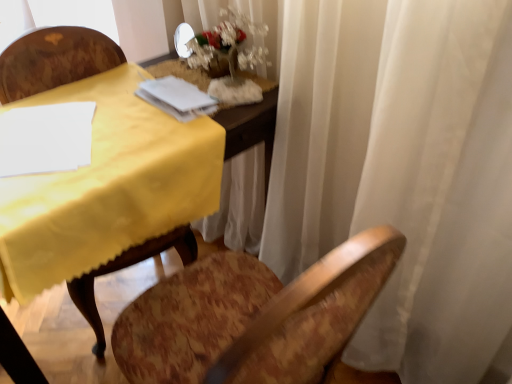
Question: From the image's perspective, would you say white frosted glass vase at upper center is shown under white paper at upper center?

Choices:
 (A) yes
 (B) no

Answer: (B)

Question: Is white frosted glass vase at upper center smaller than white paper at upper center?

Choices:
 (A) yes
 (B) no

Answer: (B)

Question: From a real-world perspective, is white frosted glass vase at upper center over white paper at upper center?

Choices:
 (A) yes
 (B) no

Answer: (A)

Question: Is white frosted glass vase at upper center thinner than white paper at upper center?

Choices:
 (A) no
 (B) yes

Answer: (A)

Question: Is white frosted glass vase at upper center aimed at white paper at upper center?

Choices:
 (A) yes
 (B) no

Answer: (A)

Question: Based on their positions, is white frosted glass vase at upper center located to the left or right of wooden chair at left?

Choices:
 (A) right
 (B) left

Answer: (A)

Question: From a real-world perspective, is white frosted glass vase at upper center physically located above or below wooden chair at left?

Choices:
 (A) below
 (B) above

Answer: (B)

Question: From the image's perspective, is white frosted glass vase at upper center above or below wooden chair at left?

Choices:
 (A) below
 (B) above

Answer: (B)

Question: Is white frosted glass vase at upper center inside the boundaries of wooden chair at left, or outside?

Choices:
 (A) outside
 (B) inside

Answer: (A)

Question: Looking at their shapes, would you say white frosted glass vase at upper center is wider or thinner than white paper at upper center?

Choices:
 (A) thin
 (B) wide

Answer: (B)

Question: Considering the positions of point (208, 46) and point (176, 99), is point (208, 46) closer or farther from the camera than point (176, 99)?

Choices:
 (A) farther
 (B) closer

Answer: (A)

Question: From their relative heights in the image, would you say white frosted glass vase at upper center is taller or shorter than white paper at upper center?

Choices:
 (A) short
 (B) tall

Answer: (B)

Question: Would you say white frosted glass vase at upper center is inside or outside white paper at upper center?

Choices:
 (A) inside
 (B) outside

Answer: (B)

Question: Does point (194, 87) appear closer or farther from the camera than point (233, 36)?

Choices:
 (A) closer
 (B) farther

Answer: (B)

Question: Based on their sizes in the image, would you say white paper at upper center is bigger or smaller than white frosted glass vase at upper center?

Choices:
 (A) big
 (B) small

Answer: (B)